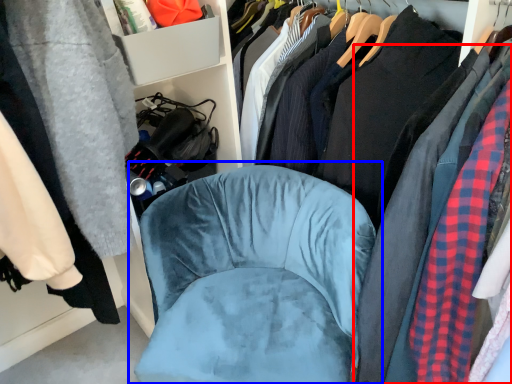
Question: Which object is closer to the camera taking this photo, clothing (highlighted by a red box) or chair (highlighted by a blue box)?

Choices:
 (A) clothing
 (B) chair

Answer: (A)